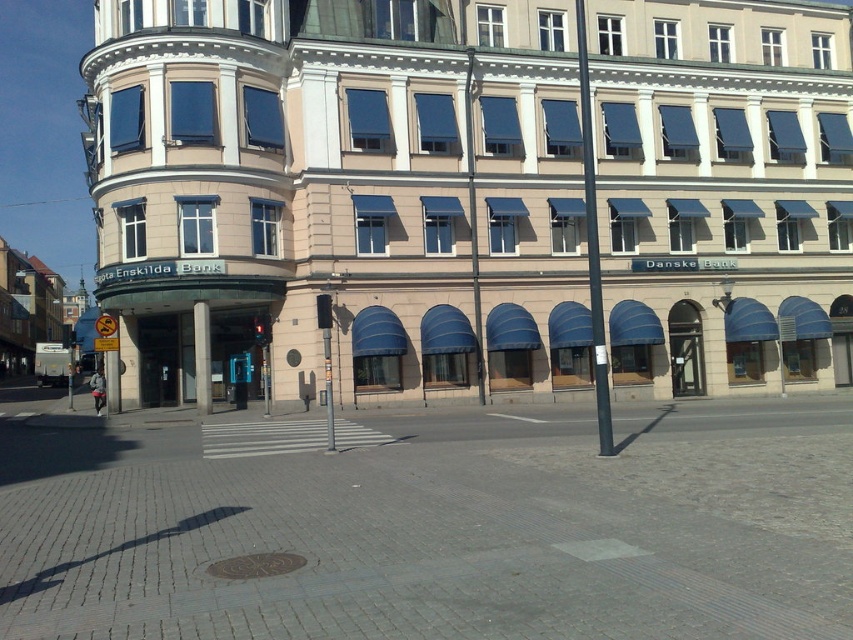
In the scene shown: Is beige stone building at center above gray concrete sidewalk at center?

Correct, beige stone building at center is located above gray concrete sidewalk at center.

Does point (416, 179) come in front of point (111, 429)?

No, it is behind (111, 429).

Find the location of a particular element. The width and height of the screenshot is (853, 640). beige stone building at center is located at coordinates (343, 188).